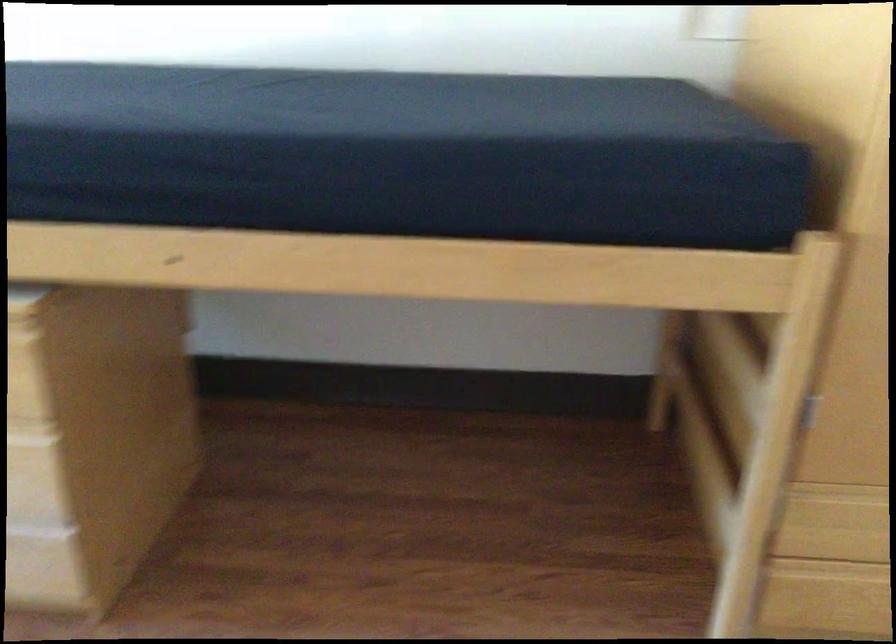
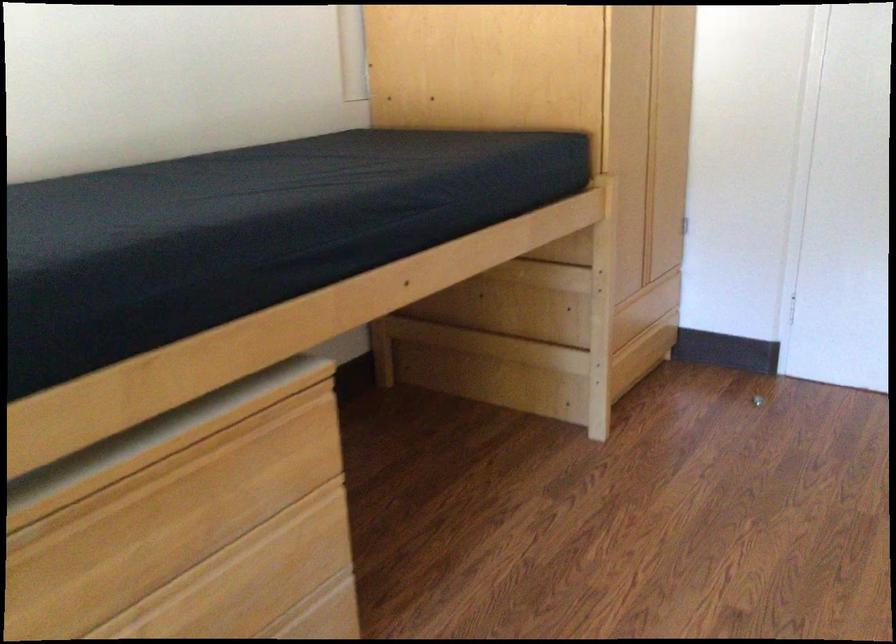
Locate, in the second image, the point that corresponds to pixel 74 126 in the first image.

(288, 205)